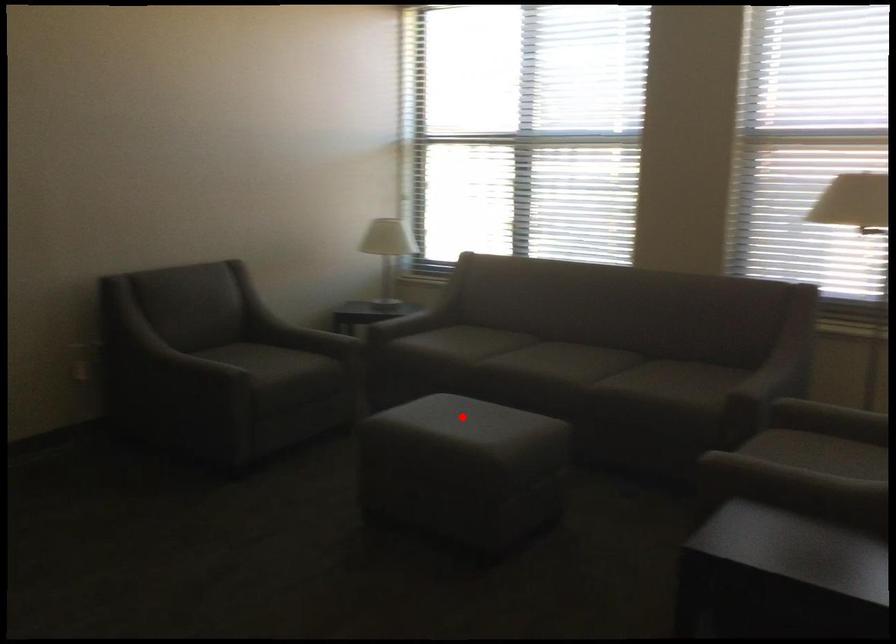
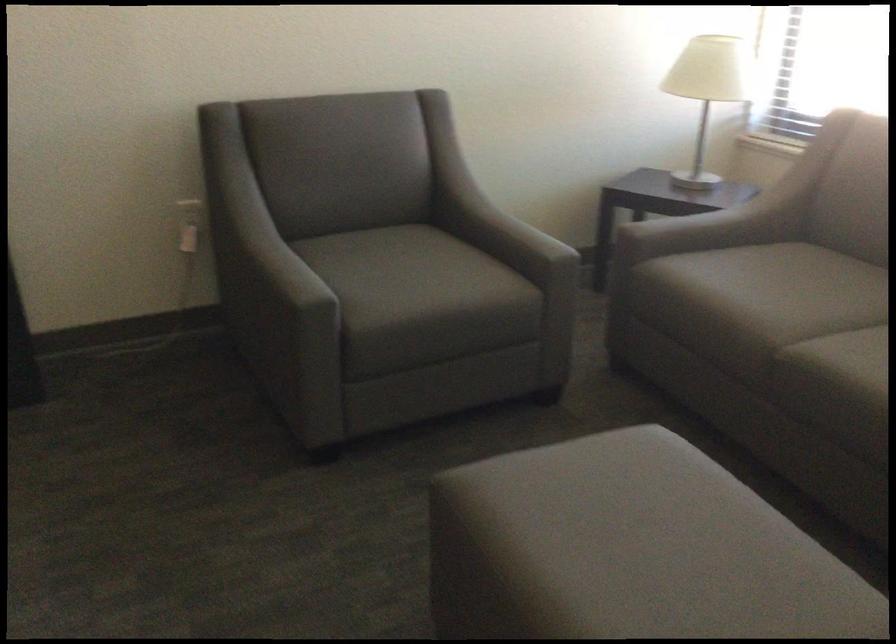
Question: I am providing you with two images of the same scene from different viewpoints. In image1, a red point is highlighted. Considering the same 3D point in image2, which of the following is correct?

Choices:
 (A) It is closer
 (B) It is farther

Answer: (A)